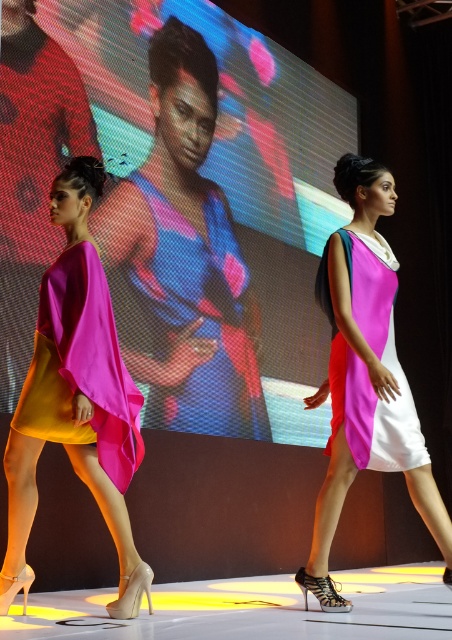
Is shiny metallic shoes at center to the right of pink satin dress at center from the viewer's perspective?

Incorrect, shiny metallic shoes at center is not on the right side of pink satin dress at center.

Which is above, shiny metallic shoes at center or pink satin dress at center?

Positioned higher is pink satin dress at center.

The image size is (452, 640). Find the location of `shiny metallic shoes at center`. shiny metallic shoes at center is located at coordinates (249, 609).

Is matte blue dress at center above matte satin dress at left?

Correct, matte blue dress at center is located above matte satin dress at left.

Is matte blue dress at center thinner than matte satin dress at left?

Incorrect, matte blue dress at center's width is not less than matte satin dress at left's.

Is point (149, 401) behind point (79, 244)?

Yes, it is behind point (79, 244).

Identify the location of matte blue dress at center. (197, 320).

Is point (100, 186) farther from viewer compared to point (71, 625)?

That is True.

Is point (81, 266) farther from camera compared to point (18, 602)?

No.

Identify the location of pink satin dress at left. The width and height of the screenshot is (452, 640). (75, 396).